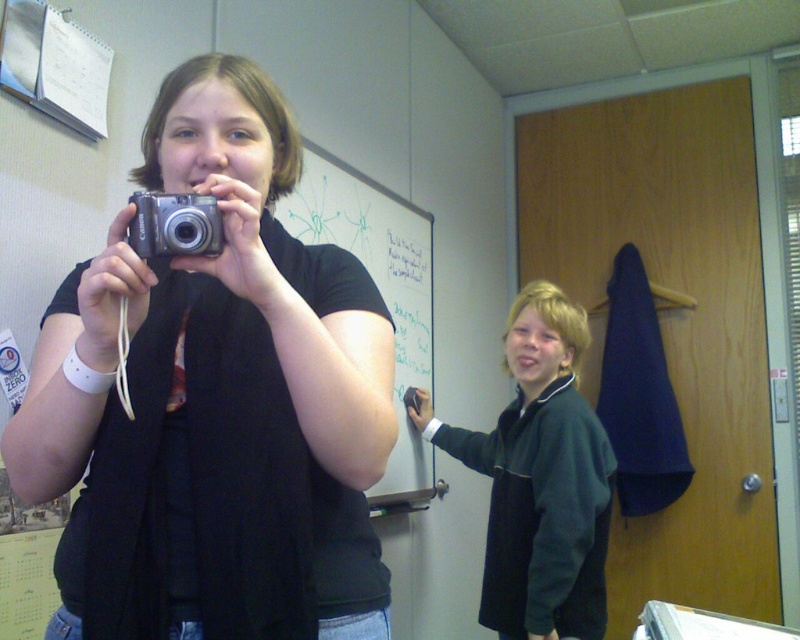
Question: Estimate the real-world distances between objects in this image. Which object is farther from the silver metallic camera at center?

Choices:
 (A) matte black camera at center
 (B) dark green fleece at center
 (C) whiteboard at upper center

Answer: (C)

Question: Which point is farther from the camera taking this photo?

Choices:
 (A) (390, 209)
 (B) (584, 531)
 (C) (173, 225)
 (D) (148, 468)

Answer: (A)

Question: Can you confirm if dark green fleece at center is smaller than silver metallic camera at center?

Choices:
 (A) no
 (B) yes

Answer: (A)

Question: Which object appears farthest from the camera in this image?

Choices:
 (A) whiteboard at upper center
 (B) silver metallic camera at center

Answer: (A)

Question: Can you confirm if matte black camera at center is positioned to the left of silver metallic camera at center?

Choices:
 (A) yes
 (B) no

Answer: (A)

Question: Considering the relative positions of dark green fleece at center and whiteboard at upper center in the image provided, where is dark green fleece at center located with respect to whiteboard at upper center?

Choices:
 (A) left
 (B) right

Answer: (B)